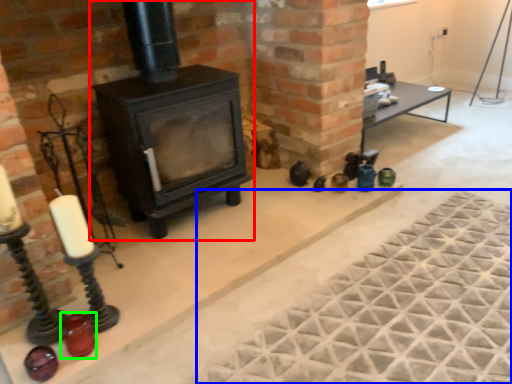
Question: Based on their relative distances, which object is farther from wood burning stove (highlighted by a red box)? Choose from mat (highlighted by a blue box) and candle holder (highlighted by a green box).

Choices:
 (A) mat
 (B) candle holder

Answer: (A)